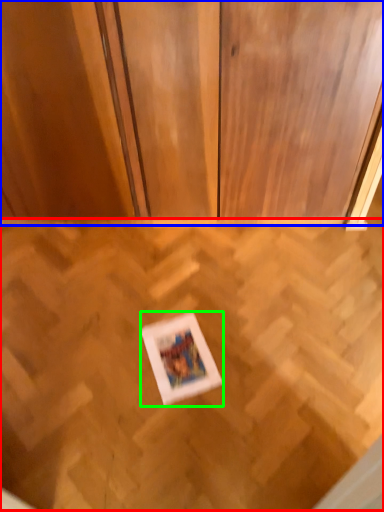
Question: Which object is positioned farthest from plywood (highlighted by a red box)? Select from dresser (highlighted by a blue box) and picture frame (highlighted by a green box).

Choices:
 (A) dresser
 (B) picture frame

Answer: (A)